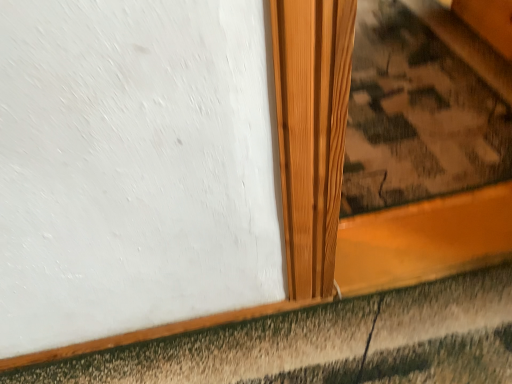
Question: Should I look upward or downward to see natural wood stair at center?

Choices:
 (A) up
 (B) down

Answer: (A)